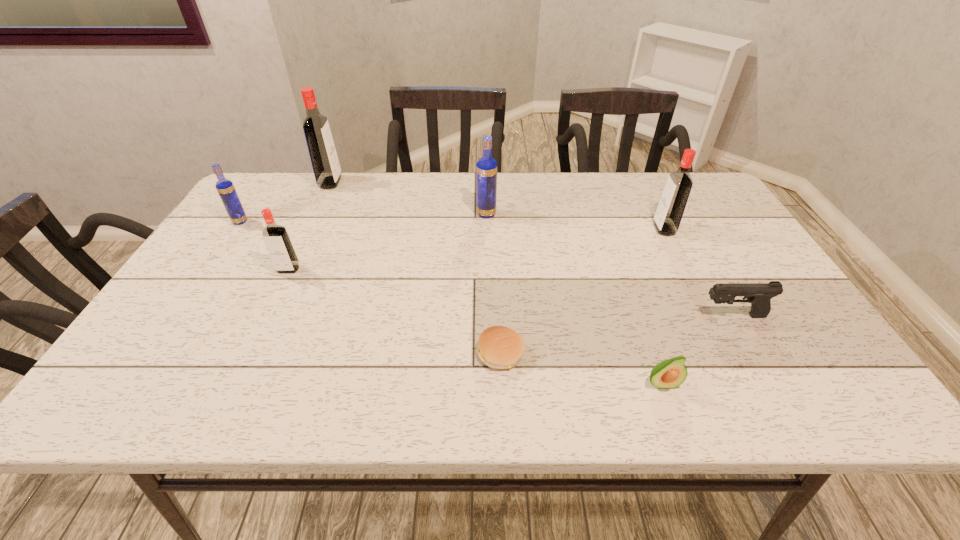
Select which red vodka appears as the second closest to the rightmost vodka. Please provide its 2D coordinates. Your answer should be formatted as a tuple, i.e. [(x, y)], where the tuple contains the x and y coordinates of a point satisfying the conditions above.

[(323, 155)]